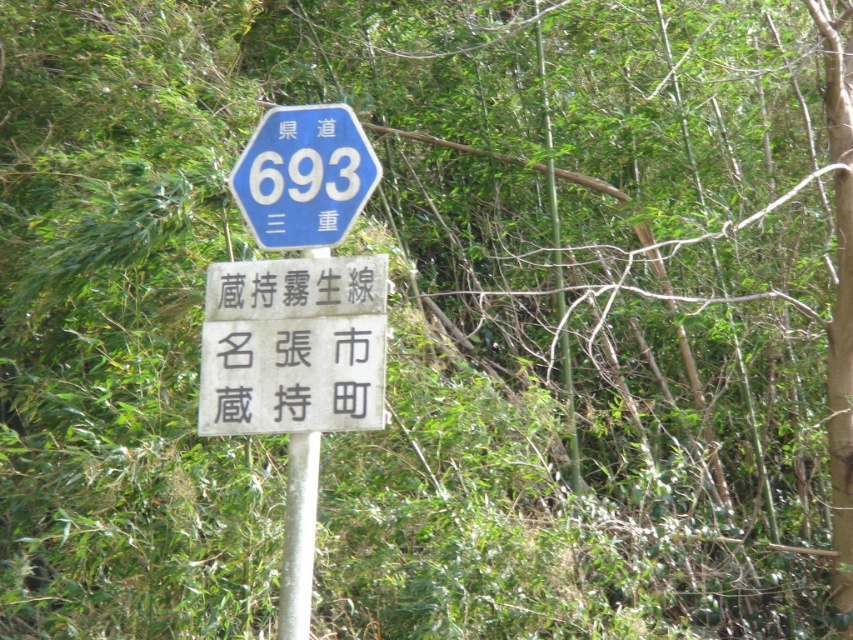
You are a hiker who wants to know the height of the white stone sign at center compared to the white metallic pole at center. Which one is taller?

The white stone sign at center is shorter than the white metallic pole at center, so the white metallic pole at center is taller.

You are a driver approaching a signpost with two signs. The top sign is a blue hexagonal sign with white text labeled as the blue plastic hexagonal sign at upper center. The bottom sign is located at point (305,177). Which sign is higher up on the pole?

The blue plastic hexagonal sign at upper center is higher up on the pole than the bottom sign located at point (305,177).

You are a hiker navigating through a forest trail and come across a signpost with a white stone sign at center. According to the scene description, where exactly is the white stone sign positioned relative to the top and bottom signs on the pole?

The white stone sign at center is located at point [293,346], which places it centrally on the pole between the top and bottom signs.